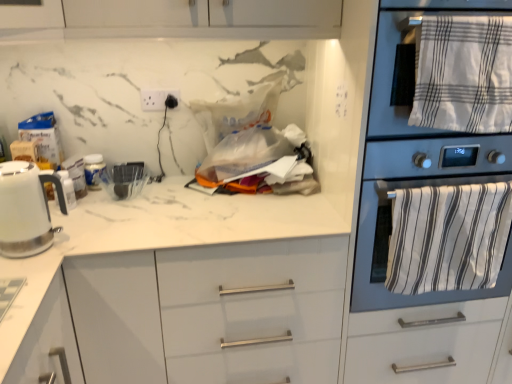
Locate an element on the screen. The image size is (512, 384). vacant area located to the right-hand side of white glossy electric kettle at left is located at coordinates (92, 233).